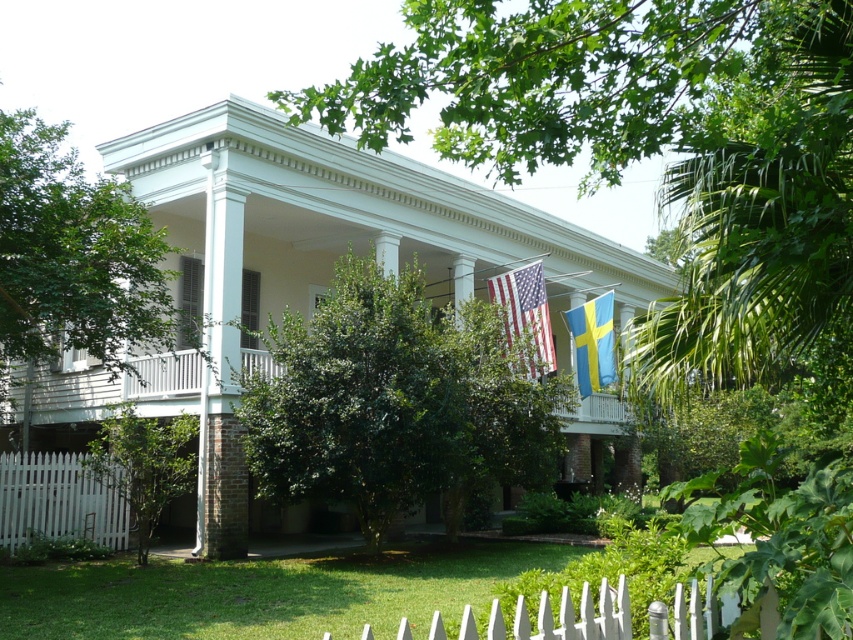
Is american flag at center positioned at the back of blue/yellow fabric flag at upper right?

No, american flag at center is closer to the viewer.

Which is more to the right, american flag at center or blue/yellow fabric flag at upper right?

blue/yellow fabric flag at upper right is more to the right.

Find the location of a particular element. The image size is (853, 640). american flag at center is located at coordinates (526, 316).

Which is more to the right, white picket fence at lower center or american flag at center?

american flag at center

Can you confirm if white picket fence at lower center is taller than american flag at center?

Correct, white picket fence at lower center is much taller as american flag at center.

Does point (762, 614) come in front of point (531, 307)?

Yes, it is.

The image size is (853, 640). In order to click on white picket fence at lower center in this screenshot , I will do `click(579, 614)`.

Who is more distant from viewer, (766, 618) or (608, 307)?

Point (608, 307)

Measure the distance between point (548, 625) and camera.

Point (548, 625) and camera are 3.43 meters apart from each other.

Who is more forward, (543, 605) or (585, 332)?

Point (543, 605)

The width and height of the screenshot is (853, 640). I want to click on white picket fence at lower center, so click(579, 614).